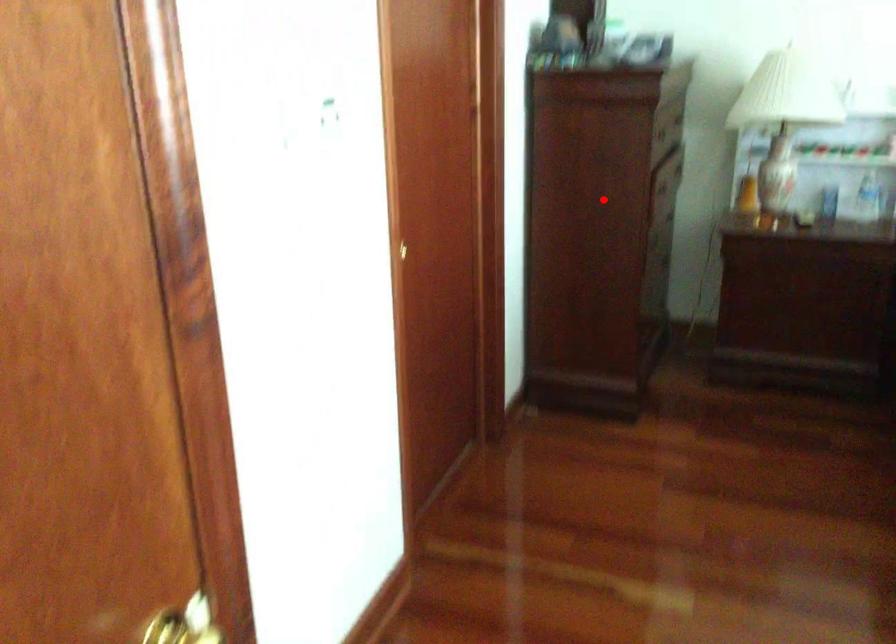
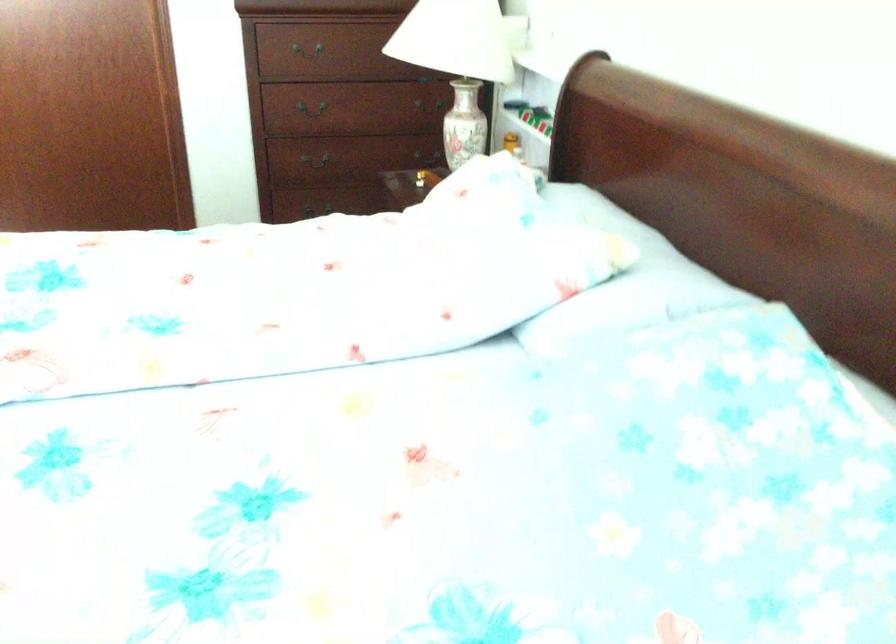
In the second image, find the point that corresponds to the highlighted location in the first image.

(313, 108)